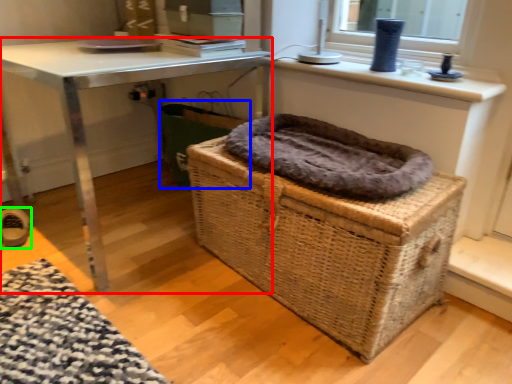
Question: Considering the real-world distances, which object is farthest from table (highlighted by a red box)? laundry basket (highlighted by a blue box) or shoe (highlighted by a green box)?

Choices:
 (A) laundry basket
 (B) shoe

Answer: (B)